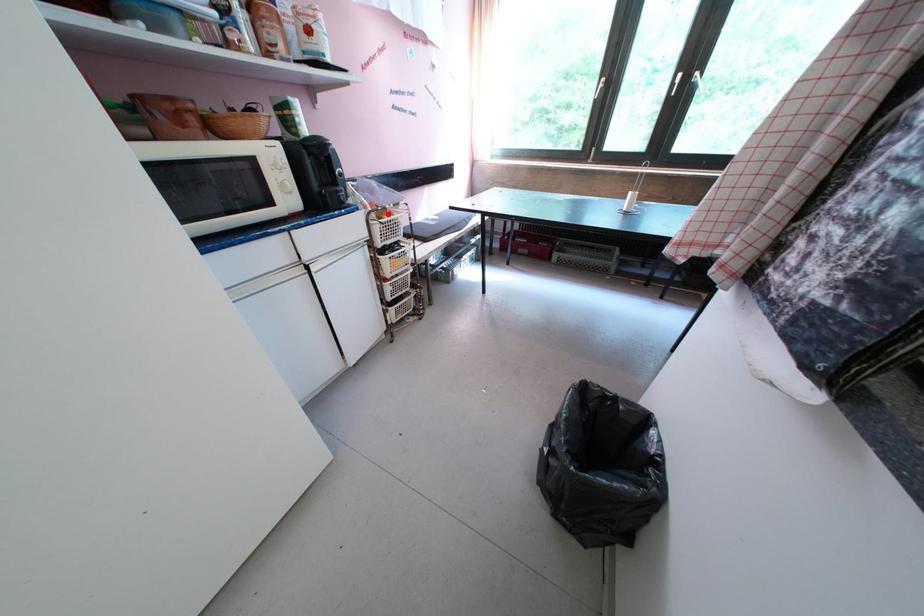
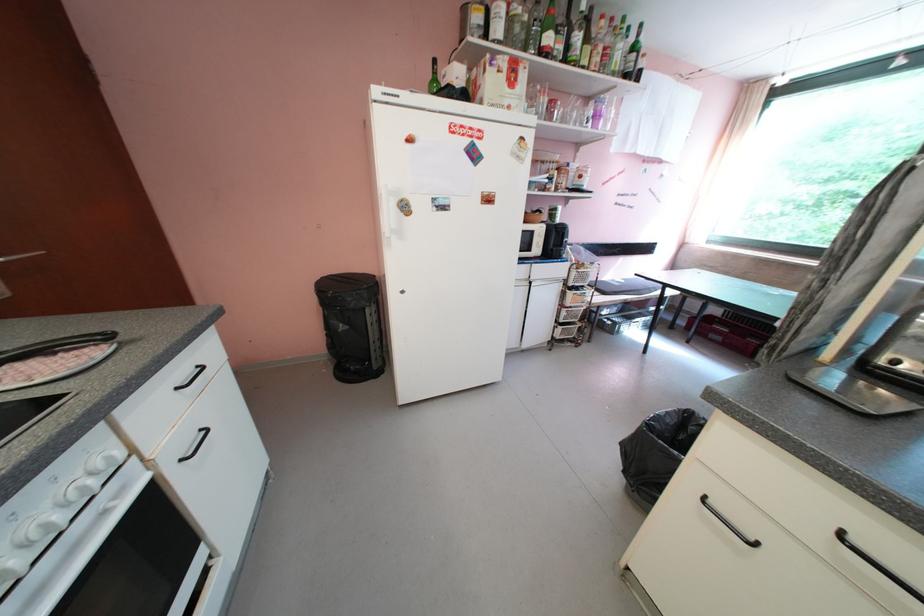
In the second image, find the point that corresponds to the highlighted location in the first image.

(588, 268)